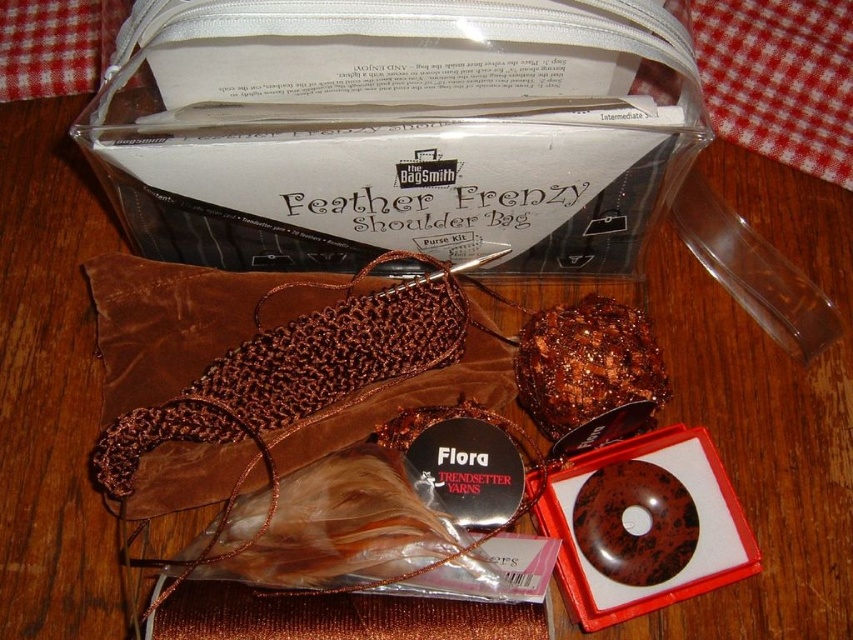
Question: Among these points, which one is nearest to the camera?

Choices:
 (A) (189, 51)
 (B) (590, 380)

Answer: (A)

Question: Is matte brown yarn at upper center above shiny brown chocolate cake at center?

Choices:
 (A) yes
 (B) no

Answer: (A)

Question: Does matte brown yarn at upper center appear over shiny brown chocolate cake at center?

Choices:
 (A) yes
 (B) no

Answer: (A)

Question: Is matte brown yarn at upper center wider than shiny brown chocolate cake at center?

Choices:
 (A) yes
 (B) no

Answer: (A)

Question: Among these points, which one is farthest from the camera?

Choices:
 (A) (666, 380)
 (B) (367, 12)

Answer: (A)